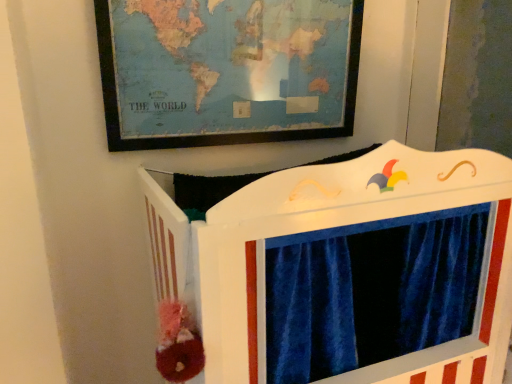
Where is `wooden world map at upper center`? The width and height of the screenshot is (512, 384). wooden world map at upper center is located at coordinates (227, 71).

What do you see at coordinates (227, 71) in the screenshot? I see `wooden world map at upper center` at bounding box center [227, 71].

What do you see at coordinates (340, 268) in the screenshot?
I see `white painted wood puppet theater at center` at bounding box center [340, 268].

Where is `white painted wood puppet theater at center`? This screenshot has height=384, width=512. white painted wood puppet theater at center is located at coordinates (340, 268).

Locate an element on the screen. wooden world map at upper center is located at coordinates (227, 71).

Would you say wooden world map at upper center is to the left or to the right of white painted wood puppet theater at center in the picture?

In the image, wooden world map at upper center appears on the left side of white painted wood puppet theater at center.

Considering the positions of objects wooden world map at upper center and white painted wood puppet theater at center in the image provided, who is in front, wooden world map at upper center or white painted wood puppet theater at center?

Positioned in front is white painted wood puppet theater at center.

Which is closer to the camera, [205,10] or [269,361]?

Point [205,10] is farther from the camera than point [269,361].

From the image's perspective, is wooden world map at upper center below white painted wood puppet theater at center?

Actually, wooden world map at upper center appears above white painted wood puppet theater at center in the image.

From a real-world perspective, is wooden world map at upper center above or below white painted wood puppet theater at center?

From a real-world perspective, wooden world map at upper center is physically above white painted wood puppet theater at center.

Considering the sizes of objects wooden world map at upper center and white painted wood puppet theater at center in the image provided, who is wider, wooden world map at upper center or white painted wood puppet theater at center?

white painted wood puppet theater at center.

Between wooden world map at upper center and white painted wood puppet theater at center, which one has less height?

Standing shorter between the two is wooden world map at upper center.

Does wooden world map at upper center have a larger size compared to white painted wood puppet theater at center?

No.

Is wooden world map at upper center not inside white painted wood puppet theater at center?

wooden world map at upper center lies outside white painted wood puppet theater at center's area.

Are wooden world map at upper center and white painted wood puppet theater at center making contact?

There is a gap between wooden world map at upper center and white painted wood puppet theater at center.

Is wooden world map at upper center looking in the opposite direction of white painted wood puppet theater at center?

No, white painted wood puppet theater at center is not at the back of wooden world map at upper center.

How different are the orientations of wooden world map at upper center and white painted wood puppet theater at center in degrees?

They differ by 0.000864 degrees in their facing directions.

Find the location of a particular element. furniture below the wooden world map at upper center (from the image's perspective) is located at coordinates (340, 268).

Which is more to the left, white painted wood puppet theater at center or wooden world map at upper center?

wooden world map at upper center is more to the left.

Is the depth of white painted wood puppet theater at center less than that of wooden world map at upper center?

Yes.

Which point is more distant from viewer, [487,365] or [249,61]?

The point [249,61] is more distant.

From the image's perspective, would you say white painted wood puppet theater at center is shown under wooden world map at upper center?

Indeed, from the image's perspective, white painted wood puppet theater at center is shown beneath wooden world map at upper center.

From a real-world perspective, which is physically below, white painted wood puppet theater at center or wooden world map at upper center?

From a 3D spatial view, white painted wood puppet theater at center is below.

Considering the sizes of white painted wood puppet theater at center and wooden world map at upper center in the image, is white painted wood puppet theater at center wider or thinner than wooden world map at upper center?

Clearly, white painted wood puppet theater at center has more width compared to wooden world map at upper center.

In the scene shown: Does white painted wood puppet theater at center have a lesser height compared to wooden world map at upper center?

In fact, white painted wood puppet theater at center may be taller than wooden world map at upper center.

Is white painted wood puppet theater at center smaller than wooden world map at upper center?

No, white painted wood puppet theater at center is not smaller than wooden world map at upper center.

Is white painted wood puppet theater at center inside or outside of wooden world map at upper center?

white painted wood puppet theater at center is not inside wooden world map at upper center, it's outside.

Is white painted wood puppet theater at center not near wooden world map at upper center?

white painted wood puppet theater at center is actually quite close to wooden world map at upper center.

Is white painted wood puppet theater at center looking in the opposite direction of wooden world map at upper center?

No, white painted wood puppet theater at center's orientation is not away from wooden world map at upper center.

From the picture: Could you measure the distance between white painted wood puppet theater at center and wooden world map at upper center?

white painted wood puppet theater at center is 17.08 inches from wooden world map at upper center.

In the image, there is a wooden world map at upper center. Identify the location of furniture below it (from the image's perspective). This screenshot has height=384, width=512. (340, 268).

This screenshot has height=384, width=512. I want to click on furniture below the wooden world map at upper center (from a real-world perspective), so click(340, 268).

The height and width of the screenshot is (384, 512). What are the coordinates of `picture frame above the white painted wood puppet theater at center (from the image's perspective)` in the screenshot? It's located at (227, 71).